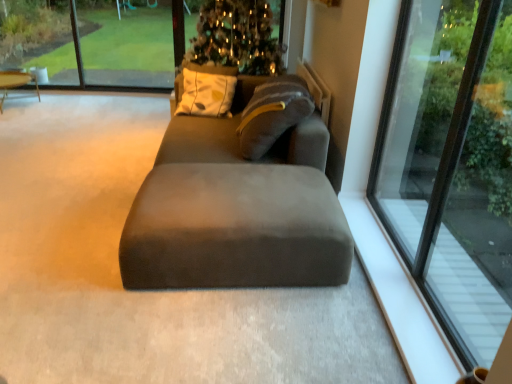
The image size is (512, 384). I want to click on matte brown table at left, so click(15, 83).

In order to click on clear glass window at upper center, which ranks as the 1th window screen in right-to-left order in this screenshot , I will do `click(91, 41)`.

The height and width of the screenshot is (384, 512). Find the location of `transparent glass window at right`. transparent glass window at right is located at coordinates (452, 165).

From a real-world perspective, is matte brown table at left on suede-like gray studio couch at center?

No, from a real-world perspective, matte brown table at left is not above suede-like gray studio couch at center.

From the picture: From the image's perspective, is matte brown table at left on top of suede-like gray studio couch at center?

Yes, from the image's perspective, matte brown table at left is above suede-like gray studio couch at center.

Is suede-like gray studio couch at center surrounded by matte brown table at left?

No, suede-like gray studio couch at center is not surrounded by matte brown table at left.

Is matte brown table at left directly adjacent to suede-like gray studio couch at center?

There is a gap between matte brown table at left and suede-like gray studio couch at center.

Which object is closer to the camera taking this photo, matte brown table at left or green glass window at upper left, the second window screen when ordered from right to left?

matte brown table at left is in front.

Starting from the matte brown table at left, which window screen is the 1st one to the right? Please provide its 2D coordinates.

[(127, 42)]

Does matte brown table at left appear on the left side of green glass window at upper left, the second window screen when ordered from right to left?

Yes.

Is point (8, 81) more distant than point (132, 62)?

No, it is in front of (132, 62).

Which of these two, clear glass window at upper center, acting as the 2th window screen starting from the left, or green glass window at upper left, the second window screen when ordered from right to left, is bigger?

With larger size is clear glass window at upper center, acting as the 2th window screen starting from the left.

From a real-world perspective, relative to green glass window at upper left, the second window screen when ordered from right to left, is clear glass window at upper center, which ranks as the 1th window screen in right-to-left order, vertically above or below?

clear glass window at upper center, which ranks as the 1th window screen in right-to-left order, is situated higher than green glass window at upper left, the second window screen when ordered from right to left, in the real world.

Which object is positioned more to the left, clear glass window at upper center, acting as the 2th window screen starting from the left, or green glass window at upper left, which is the 1th window screen in left-to-right order?

green glass window at upper left, which is the 1th window screen in left-to-right order.

Is clear glass window at upper center, acting as the 2th window screen starting from the left, facing towards green glass window at upper left, which is the 1th window screen in left-to-right order?

Yes, clear glass window at upper center, acting as the 2th window screen starting from the left, is oriented towards green glass window at upper left, which is the 1th window screen in left-to-right order.

Which is correct: green glass window at upper left, which is the 1th window screen in left-to-right order, is inside suede-like gray studio couch at center, or outside of it?

green glass window at upper left, which is the 1th window screen in left-to-right order, is not inside suede-like gray studio couch at center, it's outside.

From the image's perspective, which is below, green glass window at upper left, the second window screen when ordered from right to left, or suede-like gray studio couch at center?

From the image's view, suede-like gray studio couch at center is below.

From a real-world perspective, is green glass window at upper left, which is the 1th window screen in left-to-right order, physically located above or below suede-like gray studio couch at center?

From a real-world perspective, green glass window at upper left, which is the 1th window screen in left-to-right order, is physically above suede-like gray studio couch at center.

Looking at this image, considering the sizes of objects green glass window at upper left, which is the 1th window screen in left-to-right order, and suede-like gray studio couch at center in the image provided, who is bigger, green glass window at upper left, which is the 1th window screen in left-to-right order, or suede-like gray studio couch at center?

suede-like gray studio couch at center is bigger.

Which of these two, matte brown table at left or clear glass window at upper center, acting as the 2th window screen starting from the left, stands shorter?

matte brown table at left.

Is matte brown table at left positioned with its back to clear glass window at upper center, which ranks as the 1th window screen in right-to-left order?

Yes.

Consider the image. Could clear glass window at upper center, which ranks as the 1th window screen in right-to-left order, be considered to be inside matte brown table at left?

No, clear glass window at upper center, which ranks as the 1th window screen in right-to-left order, is not inside matte brown table at left.

Is matte brown table at left not inside transparent glass window at right?

Absolutely, matte brown table at left is external to transparent glass window at right.

Which is more to the left, matte brown table at left or transparent glass window at right?

matte brown table at left.

How distant is matte brown table at left from transparent glass window at right?

A distance of 4.69 meters exists between matte brown table at left and transparent glass window at right.

Considering the positions of point (4, 74) and point (426, 52), is point (4, 74) closer or farther from the camera than point (426, 52)?

Point (4, 74).

Which object is wider, transparent glass window at right or suede-like gray studio couch at center?

Wider between the two is suede-like gray studio couch at center.

Is transparent glass window at right in front of suede-like gray studio couch at center?

Yes.

Which object is positioned more to the right, transparent glass window at right or suede-like gray studio couch at center?

Positioned to the right is transparent glass window at right.

Where is `studio couch that is above the matte brown table at left (from a real-world perspective)`? The height and width of the screenshot is (384, 512). studio couch that is above the matte brown table at left (from a real-world perspective) is located at coordinates (236, 210).

Locate an element on the screen. This screenshot has height=384, width=512. table beneath the green glass window at upper left, the second window screen when ordered from right to left (from a real-world perspective) is located at coordinates (15, 83).

Which object lies nearer to the anchor point transparent glass window at right, clear glass window at upper center, acting as the 2th window screen starting from the left, or suede-like gray studio couch at center?

The object closer to transparent glass window at right is suede-like gray studio couch at center.

Considering their positions, is matte brown table at left positioned closer to suede-like gray studio couch at center than transparent glass window at right?

transparent glass window at right is positioned closer to the anchor suede-like gray studio couch at center.

When comparing their distances from clear glass window at upper center, which ranks as the 1th window screen in right-to-left order, does green glass window at upper left, which is the 1th window screen in left-to-right order, or matte brown table at left seem closer?

green glass window at upper left, which is the 1th window screen in left-to-right order.

Considering their positions, is transparent glass window at right positioned further to clear glass window at upper center, which ranks as the 1th window screen in right-to-left order, than green glass window at upper left, the second window screen when ordered from right to left?

transparent glass window at right is positioned further to the anchor clear glass window at upper center, which ranks as the 1th window screen in right-to-left order.

Considering their positions, is suede-like gray studio couch at center positioned closer to transparent glass window at right than clear glass window at upper center, which ranks as the 1th window screen in right-to-left order?

Based on the image, suede-like gray studio couch at center appears to be nearer to transparent glass window at right.

When comparing their distances from clear glass window at upper center, which ranks as the 1th window screen in right-to-left order, does suede-like gray studio couch at center or matte brown table at left seem further?

Among the two, suede-like gray studio couch at center is located further to clear glass window at upper center, which ranks as the 1th window screen in right-to-left order.

Looking at this image, considering their positions, is green glass window at upper left, the second window screen when ordered from right to left, positioned further to matte brown table at left than transparent glass window at right?

transparent glass window at right lies further to matte brown table at left than the other object.

Considering their positions, is matte brown table at left positioned further to transparent glass window at right than clear glass window at upper center, which ranks as the 1th window screen in right-to-left order?

matte brown table at left.

Locate an element on the screen. The height and width of the screenshot is (384, 512). table between transparent glass window at right and green glass window at upper left, the second window screen when ordered from right to left, from front to back is located at coordinates pos(15,83).

Identify the location of window screen between transparent glass window at right and green glass window at upper left, which is the 1th window screen in left-to-right order, from front to back. (91, 41).

Locate an element on the screen. studio couch between matte brown table at left and transparent glass window at right in the horizontal direction is located at coordinates (236, 210).

Where is `window screen between suede-like gray studio couch at center and green glass window at upper left, which is the 1th window screen in left-to-right order, in the front-back direction`? window screen between suede-like gray studio couch at center and green glass window at upper left, which is the 1th window screen in left-to-right order, in the front-back direction is located at coordinates (91, 41).